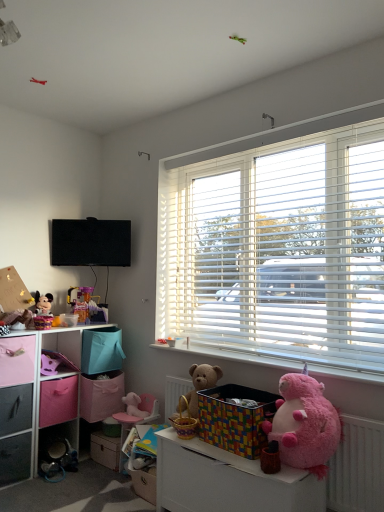
Question: Can you confirm if white plastic radiator at lower right is smaller than white plastic window sill at lower center?

Choices:
 (A) yes
 (B) no

Answer: (B)

Question: Would you say white plastic radiator at lower right is outside white plastic window sill at lower center?

Choices:
 (A) yes
 (B) no

Answer: (A)

Question: Can you confirm if white plastic radiator at lower right is bigger than white plastic window sill at lower center?

Choices:
 (A) yes
 (B) no

Answer: (A)

Question: Is white plastic radiator at lower right to the left of white plastic window sill at lower center from the viewer's perspective?

Choices:
 (A) no
 (B) yes

Answer: (A)

Question: Is white plastic radiator at lower right closer to the viewer compared to white plastic window sill at lower center?

Choices:
 (A) yes
 (B) no

Answer: (A)

Question: Is metallic gray drawer at lower left, the 2th drawer positioned from the right, wider or thinner than black matte television at upper left?

Choices:
 (A) wide
 (B) thin

Answer: (A)

Question: In terms of size, does metallic gray drawer at lower left, the 2th drawer positioned from the right, appear bigger or smaller than black matte television at upper left?

Choices:
 (A) big
 (B) small

Answer: (A)

Question: Would you say metallic gray drawer at lower left, the second drawer positioned from the left, is to the left or to the right of black matte television at upper left in the picture?

Choices:
 (A) right
 (B) left

Answer: (B)

Question: Would you say metallic gray drawer at lower left, the second drawer positioned from the left, is inside or outside black matte television at upper left?

Choices:
 (A) inside
 (B) outside

Answer: (B)

Question: In terms of height, does white plastic window sill at lower center look taller or shorter compared to brushed metal drawer at lower left, arranged as the 1th drawer when viewed from the left?

Choices:
 (A) tall
 (B) short

Answer: (B)

Question: Based on their sizes in the image, would you say white plastic window sill at lower center is bigger or smaller than brushed metal drawer at lower left, arranged as the 1th drawer when viewed from the left?

Choices:
 (A) small
 (B) big

Answer: (A)

Question: From a real-world perspective, is white plastic window sill at lower center above or below brushed metal drawer at lower left, which is the 3th drawer in right-to-left order?

Choices:
 (A) above
 (B) below

Answer: (A)

Question: Visually, is white plastic window sill at lower center positioned to the left or to the right of brushed metal drawer at lower left, which is the 3th drawer in right-to-left order?

Choices:
 (A) left
 (B) right

Answer: (B)

Question: Would you say pink plush toy at lower left, which is the first toy in bottom-to-top order, is to the left or to the right of pink fabric basket at lower left, which is counted as the second toy, starting from the left, in the picture?

Choices:
 (A) right
 (B) left

Answer: (A)

Question: Relative to pink fabric basket at lower left, which is counted as the second toy, starting from the left, is pink plush toy at lower left, arranged as the 3th toy when viewed from the top, in front or behind?

Choices:
 (A) front
 (B) behind

Answer: (A)